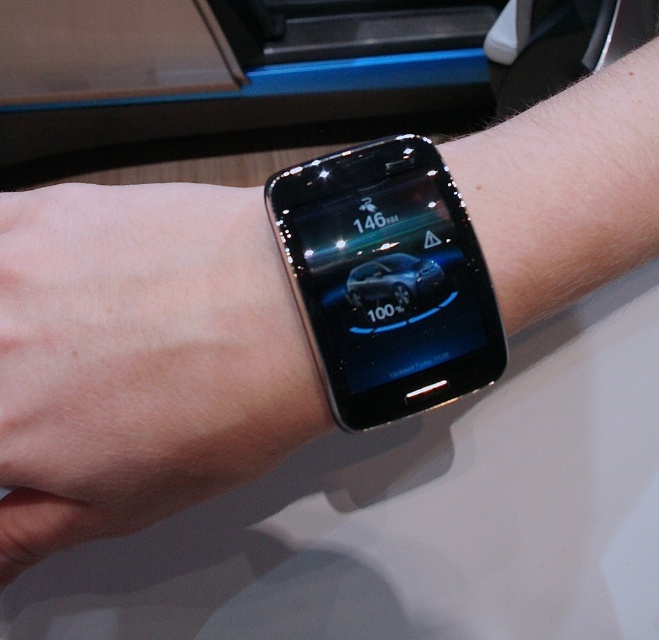
Can you confirm if satin gold watch at center is wider than sleek metallic car at center?

Indeed, satin gold watch at center has a greater width compared to sleek metallic car at center.

What do you see at coordinates (140, 358) in the screenshot? Image resolution: width=659 pixels, height=640 pixels. I see `satin gold watch at center` at bounding box center [140, 358].

Is point (165, 237) less distant than point (357, 273)?

No, (165, 237) is further to viewer.

This screenshot has height=640, width=659. What are the coordinates of `satin gold watch at center` in the screenshot? It's located at [x=140, y=358].

Can you confirm if satin gold watch at center is smaller than sleek black smartwatch at center?

No, satin gold watch at center is not smaller than sleek black smartwatch at center.

Is satin gold watch at center positioned before sleek black smartwatch at center?

No.

At what (x,y) coordinates should I click in order to perform the action: click on satin gold watch at center. Please return your answer as a coordinate pair (x, y). Looking at the image, I should click on (140, 358).

Can you confirm if sleek black smartwatch at center is thinner than sleek metallic car at center?

Incorrect, sleek black smartwatch at center's width is not less than sleek metallic car at center's.

From the picture: Who is positioned more to the right, sleek black smartwatch at center or sleek metallic car at center?

Positioned to the right is sleek metallic car at center.

Who is more forward, (397, 180) or (395, 272)?

Point (395, 272)

Where is `sleek black smartwatch at center`? This screenshot has height=640, width=659. sleek black smartwatch at center is located at coordinates [x=386, y=280].